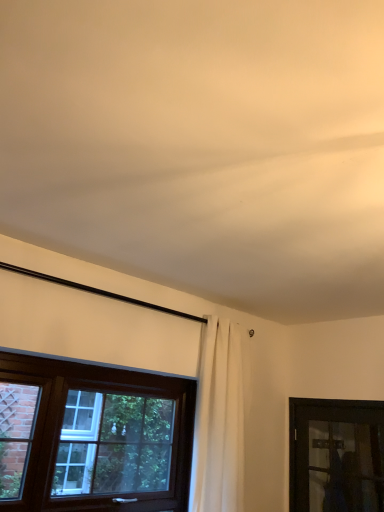
Question: Can you confirm if white fabric curtain at center is bigger than brown wooden window at lower left, which appears as the 2th window when viewed from the right?

Choices:
 (A) no
 (B) yes

Answer: (B)

Question: Is white fabric curtain at center positioned behind brown wooden window at lower left, which appears as the 2th window when viewed from the right?

Choices:
 (A) yes
 (B) no

Answer: (A)

Question: Could brown wooden window at lower left, which appears as the 1th window when viewed from the left, be considered to be inside white fabric curtain at center?

Choices:
 (A) yes
 (B) no

Answer: (B)

Question: Considering the relative sizes of white fabric curtain at center and brown wooden window at lower left, which appears as the 1th window when viewed from the left, in the image provided, is white fabric curtain at center thinner than brown wooden window at lower left, which appears as the 1th window when viewed from the left,?

Choices:
 (A) no
 (B) yes

Answer: (A)

Question: Is white fabric curtain at center outside of brown wooden window at lower left, which appears as the 1th window when viewed from the left?

Choices:
 (A) yes
 (B) no

Answer: (A)

Question: Is brown wooden window at lower left, which appears as the 1th window when viewed from the left, to the left or to the right of transparent glass door at lower right, marked as the 1th window in a right-to-left arrangement, in the image?

Choices:
 (A) right
 (B) left

Answer: (B)

Question: From the image's perspective, is brown wooden window at lower left, which appears as the 1th window when viewed from the left, located above or below transparent glass door at lower right, marked as the 1th window in a right-to-left arrangement?

Choices:
 (A) below
 (B) above

Answer: (B)

Question: Based on their sizes in the image, would you say brown wooden window at lower left, which appears as the 2th window when viewed from the right, is bigger or smaller than transparent glass door at lower right, which ranks as the second window in left-to-right order?

Choices:
 (A) big
 (B) small

Answer: (A)

Question: Is brown wooden window at lower left, which appears as the 2th window when viewed from the right, taller or shorter than transparent glass door at lower right, marked as the 1th window in a right-to-left arrangement?

Choices:
 (A) tall
 (B) short

Answer: (A)

Question: Is point (180, 476) positioned closer to the camera than point (208, 379)?

Choices:
 (A) closer
 (B) farther

Answer: (A)

Question: Considering the positions of brown wooden window at lower left, which appears as the 2th window when viewed from the right, and white fabric curtain at center in the image, is brown wooden window at lower left, which appears as the 2th window when viewed from the right, taller or shorter than white fabric curtain at center?

Choices:
 (A) tall
 (B) short

Answer: (B)

Question: From a real-world perspective, is brown wooden window at lower left, which appears as the 1th window when viewed from the left, positioned above or below white fabric curtain at center?

Choices:
 (A) below
 (B) above

Answer: (A)

Question: Based on their positions, is brown wooden window at lower left, which appears as the 1th window when viewed from the left, located to the left or right of white fabric curtain at center?

Choices:
 (A) right
 (B) left

Answer: (B)

Question: From a real-world perspective, is white fabric curtain at center positioned above or below transparent glass door at lower right, which ranks as the second window in left-to-right order?

Choices:
 (A) above
 (B) below

Answer: (A)

Question: From the image's perspective, is white fabric curtain at center located above or below transparent glass door at lower right, marked as the 1th window in a right-to-left arrangement?

Choices:
 (A) below
 (B) above

Answer: (B)